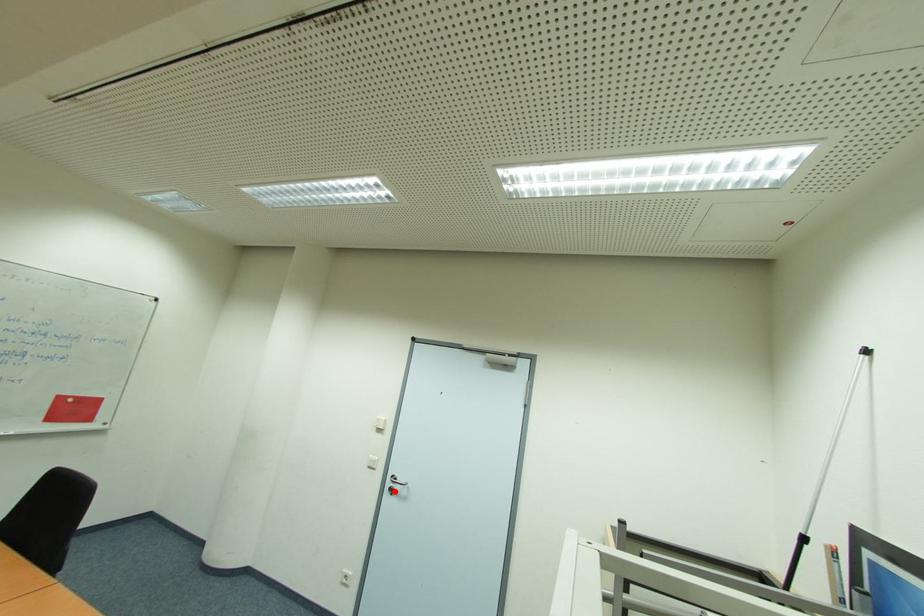
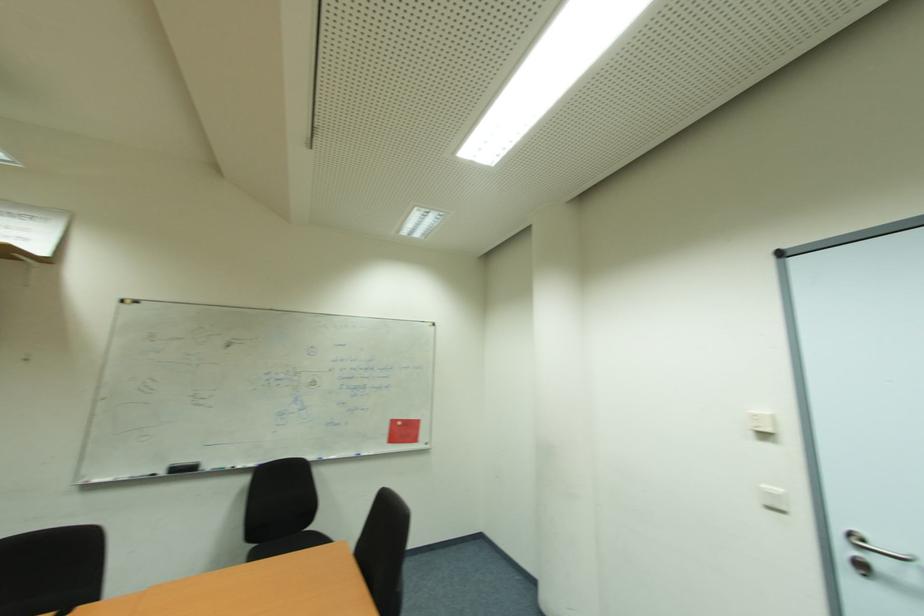
Question: I am providing you with two images of the same scene from different viewpoints. In image1, a red point is highlighted. Considering the same 3D point in image2, which of the following is correct?

Choices:
 (A) It is closer
 (B) It is farther

Answer: (A)